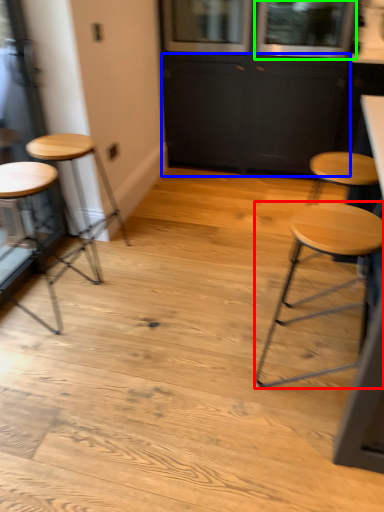
Question: Considering the real-world distances, which object is farthest from stool (highlighted by a red box)? cabinetry (highlighted by a blue box) or window (highlighted by a green box)?

Choices:
 (A) cabinetry
 (B) window

Answer: (B)